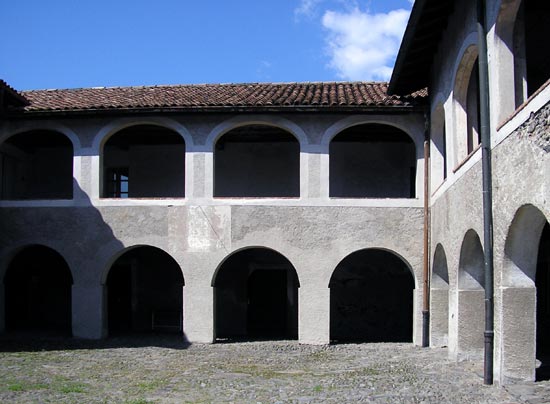
I want to click on door, so click(119, 189).